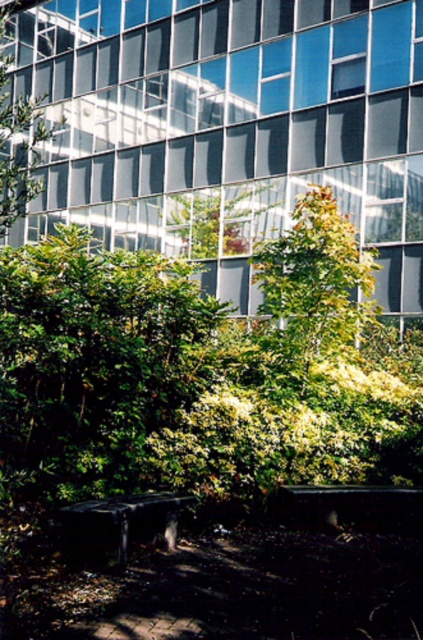
Question: Does green leafy tree at center have a greater width compared to dark gray concrete bench at lower center?

Choices:
 (A) no
 (B) yes

Answer: (B)

Question: Can you confirm if green leafy tree at center is positioned above dark gray concrete bench at lower center?

Choices:
 (A) no
 (B) yes

Answer: (B)

Question: From the image, what is the correct spatial relationship of green leafy tree at center in relation to dark gray concrete bench at lower center?

Choices:
 (A) right
 (B) left

Answer: (A)

Question: Which point is closer to the camera?

Choices:
 (A) (354, 484)
 (B) (304, 282)
 (C) (104, 502)

Answer: (C)

Question: Which point appears closest to the camera in this image?

Choices:
 (A) (98, 536)
 (B) (412, 516)

Answer: (A)

Question: Estimate the real-world distances between objects in this image. Which object is closer to the dark gray concrete bench at lower center?

Choices:
 (A) dark brown wooden bench at lower center
 (B) green leafy tree at center

Answer: (A)